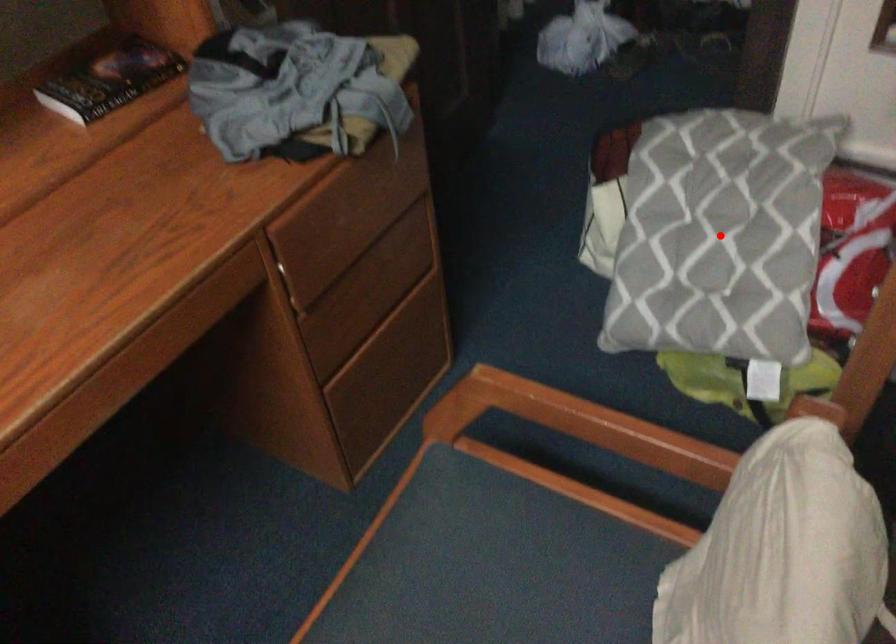
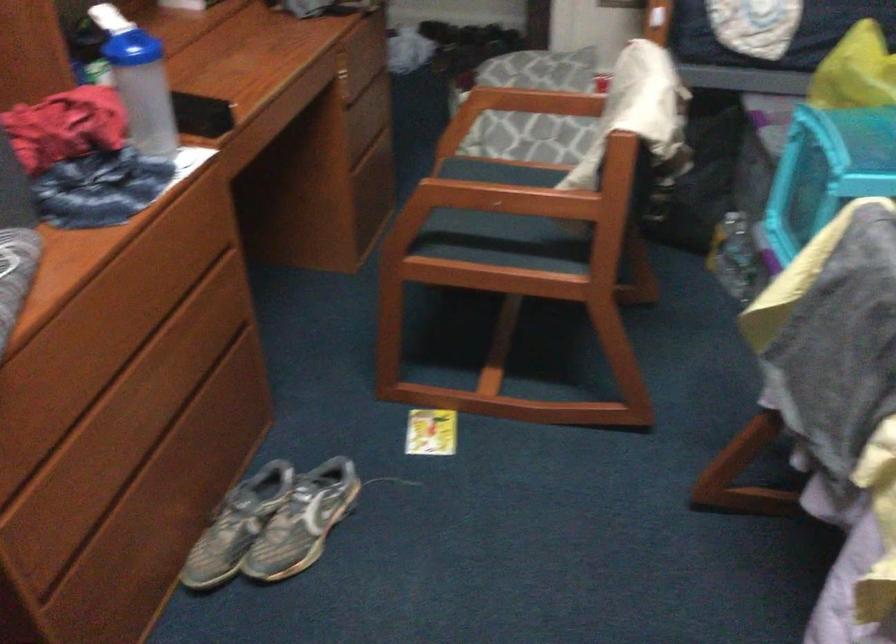
Question: I am providing you with two images of the same scene from different viewpoints. A red point is marked on the first image. Is the red point's position out of view in image 2?

Choices:
 (A) Yes
 (B) No

Answer: (A)